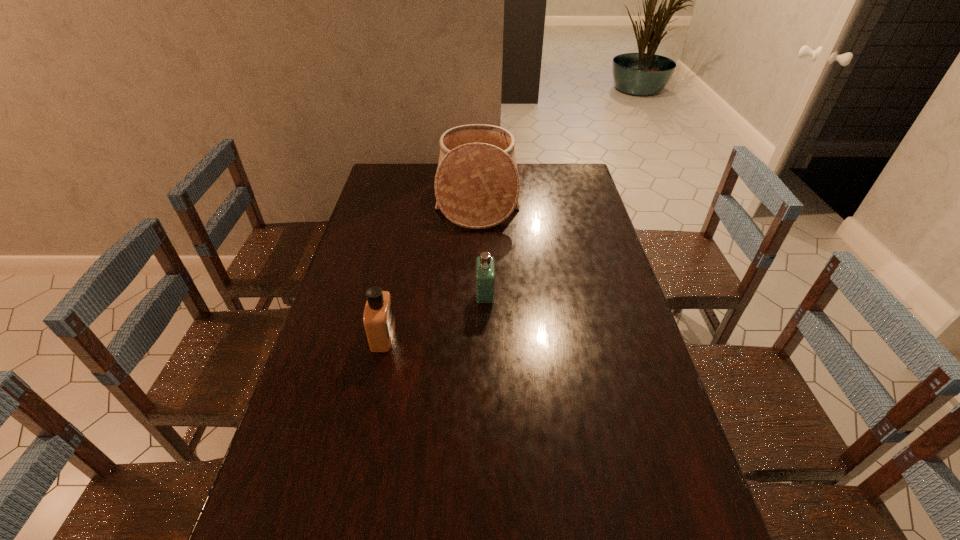
Where is `vacant space located 0.270m on the front label of the nearest object`? The height and width of the screenshot is (540, 960). vacant space located 0.270m on the front label of the nearest object is located at coordinates (490, 335).

The image size is (960, 540). Identify the location of object that is positioned at the far edge. (477, 185).

I want to click on object present at the left edge, so click(x=378, y=317).

Locate an element on the screen. The height and width of the screenshot is (540, 960). vacant space at the far edge is located at coordinates (422, 175).

In the image, there is a desktop. Where is `vacant space at the left edge`? This screenshot has height=540, width=960. vacant space at the left edge is located at coordinates (369, 251).

Identify the location of vacant space at the right edge. This screenshot has width=960, height=540. (610, 263).

Where is `free space at the far left corner`? This screenshot has width=960, height=540. free space at the far left corner is located at coordinates (377, 181).

This screenshot has width=960, height=540. Identify the location of vacant area that lies between the farther perfume and the left perfume. (434, 316).

Find the location of a particular element. This screenshot has height=540, width=960. free space that is in between the tallest object and the left perfume is located at coordinates (430, 266).

The width and height of the screenshot is (960, 540). I want to click on vacant area between the second farthest object and the leftmost object, so 434,316.